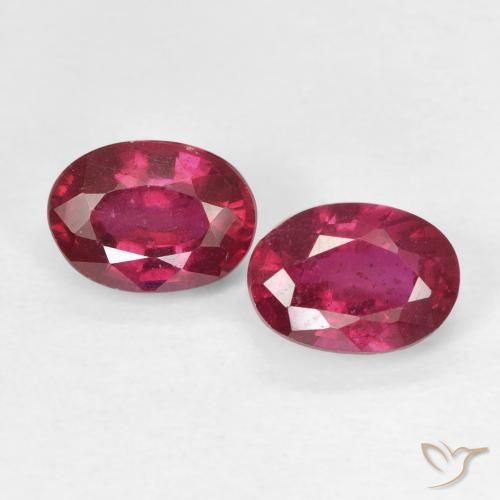
Where is `white surface`? white surface is located at coordinates (300, 63).